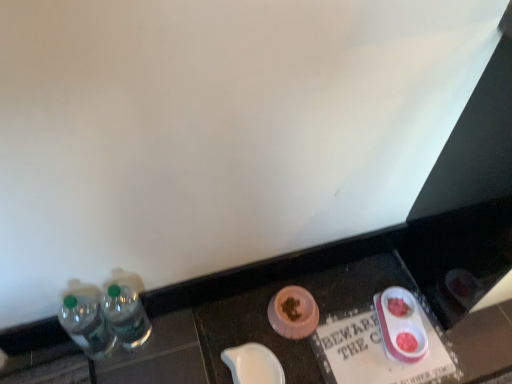
What do you see at coordinates (125, 308) in the screenshot? The image size is (512, 384). I see `clear plastic bottles at left, which is counted as the first bottle, starting from the right` at bounding box center [125, 308].

You are a GUI agent. You are given a task and a screenshot of the screen. Output one action in this format:
    pyautogui.click(x=<x>, y=<y>)
    Task: Click on the white paper sign at lower center
    The height and width of the screenshot is (384, 512).
    Given the screenshot: What is the action you would take?
    pyautogui.click(x=376, y=351)

Measure the distance between point (248, 273) and camera.

Point (248, 273) and camera are 4.66 feet apart.

Where is `clear plastic bottles at left`? Image resolution: width=512 pixels, height=384 pixels. clear plastic bottles at left is located at coordinates (316, 293).

The height and width of the screenshot is (384, 512). I want to click on clear plastic bottles at left, which is counted as the first bottle, starting from the right, so click(125, 308).

Could you tell me if clear plastic bottles at left is turned towards white paper sign at lower center?

Yes, clear plastic bottles at left is oriented towards white paper sign at lower center.

Is clear plastic bottles at left not within white paper sign at lower center?

Absolutely, clear plastic bottles at left is external to white paper sign at lower center.

Considering the sizes of objects clear plastic bottles at left and white paper sign at lower center in the image provided, who is wider, clear plastic bottles at left or white paper sign at lower center?

With larger width is white paper sign at lower center.

From the image's perspective, would you say clear plastic bottles at left is positioned over white paper sign at lower center?

Indeed, from the image's perspective, clear plastic bottles at left is shown above white paper sign at lower center.

Is clear plastic bottles at left smaller than clear plastic bottles at left, the 2th bottle viewed from the left?

No.

Is clear plastic bottles at left taller than clear plastic bottles at left, which is counted as the first bottle, starting from the right?

No.

Does clear plastic bottles at left have a lesser width compared to clear plastic bottles at left, which is counted as the first bottle, starting from the right?

Yes.

What's the angular difference between clear plastic bottles at left and clear plastic bottles at left, the 2th bottle viewed from the left,'s facing directions?

0.929 degrees.

How many degrees apart are the facing directions of white paper sign at lower center and pink plastic food bowls at lower right, arranged as the 1th tableware when viewed from the right?

white paper sign at lower center and pink plastic food bowls at lower right, arranged as the 1th tableware when viewed from the right, are facing 19.8 degrees away from each other.

Is the position of white paper sign at lower center more distant than that of pink plastic food bowls at lower right, arranged as the 1th tableware when viewed from the right?

No.

Does white paper sign at lower center have a lesser width compared to pink plastic food bowls at lower right, arranged as the 1th tableware when viewed from the right?

In fact, white paper sign at lower center might be wider than pink plastic food bowls at lower right, arranged as the 1th tableware when viewed from the right.

Is white paper sign at lower center taller than pink plastic food bowls at lower right, placed as the second tableware when sorted from left to right?

Incorrect, the height of white paper sign at lower center is not larger of that of pink plastic food bowls at lower right, placed as the second tableware when sorted from left to right.

Looking at this image, could you tell me if clear plastic bottles at left, positioned as the second bottle in right-to-left order, is turned towards pink plastic food bowls at lower right, placed as the second tableware when sorted from left to right?

No, clear plastic bottles at left, positioned as the second bottle in right-to-left order, is not facing towards pink plastic food bowls at lower right, placed as the second tableware when sorted from left to right.

Is clear plastic bottles at left, positioned as the second bottle in right-to-left order, not inside pink plastic food bowls at lower right, placed as the second tableware when sorted from left to right?

clear plastic bottles at left, positioned as the second bottle in right-to-left order, is positioned outside pink plastic food bowls at lower right, placed as the second tableware when sorted from left to right.

Which is behind, clear plastic bottles at left, positioned as the second bottle in right-to-left order, or pink plastic food bowls at lower right, placed as the second tableware when sorted from left to right?

pink plastic food bowls at lower right, placed as the second tableware when sorted from left to right, is behind.

Does clear plastic bottles at left, the 1th bottle viewed from the left, have a larger size compared to pink plastic food bowls at lower right, arranged as the 1th tableware when viewed from the right?

Indeed, clear plastic bottles at left, the 1th bottle viewed from the left, has a larger size compared to pink plastic food bowls at lower right, arranged as the 1th tableware when viewed from the right.

This screenshot has width=512, height=384. I want to click on tableware above the clear plastic bottles at left (from a real-world perspective), so click(401, 325).

Does clear plastic bottles at left have a greater width compared to pink plastic food bowls at lower right, arranged as the 1th tableware when viewed from the right?

Incorrect, the width of clear plastic bottles at left does not surpass that of pink plastic food bowls at lower right, arranged as the 1th tableware when viewed from the right.

Is clear plastic bottles at left positioned behind pink plastic food bowls at lower right, arranged as the 1th tableware when viewed from the right?

No, the depth of clear plastic bottles at left is less than that of pink plastic food bowls at lower right, arranged as the 1th tableware when viewed from the right.

Which object is positioned more to the right, clear plastic bottles at left or pink plastic food bowls at lower right, arranged as the 1th tableware when viewed from the right?

pink plastic food bowls at lower right, arranged as the 1th tableware when viewed from the right, is more to the right.

Considering the relative sizes of white glossy bowl at lower center, the 2th tableware positioned from the right, and pink plastic food bowls at lower right, placed as the second tableware when sorted from left to right, in the image provided, is white glossy bowl at lower center, the 2th tableware positioned from the right, taller than pink plastic food bowls at lower right, placed as the second tableware when sorted from left to right,?

No.

Is white glossy bowl at lower center, the 2th tableware positioned from the right, to the left of pink plastic food bowls at lower right, arranged as the 1th tableware when viewed from the right, from the viewer's perspective?

Yes.

Is white glossy bowl at lower center, the 2th tableware positioned from the right, positioned with its back to pink plastic food bowls at lower right, placed as the second tableware when sorted from left to right?

No.

Would you consider white glossy bowl at lower center, the 2th tableware positioned from the right, to be distant from pink plastic food bowls at lower right, arranged as the 1th tableware when viewed from the right?

They are positioned close to each other.

Is clear plastic bottles at left, the 2th bottle viewed from the left, shorter than clear plastic bottles at left?

In fact, clear plastic bottles at left, the 2th bottle viewed from the left, may be taller than clear plastic bottles at left.

Is clear plastic bottles at left, the 2th bottle viewed from the left, aimed at clear plastic bottles at left?

No.

Where is `writing on the right of the clear plastic bottles at left`? The height and width of the screenshot is (384, 512). writing on the right of the clear plastic bottles at left is located at coordinates (376, 351).

You are a GUI agent. You are given a task and a screenshot of the screen. Output one action in this format:
    pyautogui.click(x=<x>, y=<y>)
    Task: Click on the 1st bottle counting from the left side of the clear plastic bottles at left
    
    Given the screenshot: What is the action you would take?
    pyautogui.click(x=125, y=308)

Based on their spatial positions, is clear plastic bottles at left or white paper sign at lower center closer to clear plastic bottles at left, which is counted as the first bottle, starting from the right?

clear plastic bottles at left is positioned closer to the anchor clear plastic bottles at left, which is counted as the first bottle, starting from the right.

Looking at the image, which one is located closer to white glossy bowl at lower center, the first tableware in the left-to-right sequence, clear plastic bottles at left, the 1th bottle viewed from the left, or pink plastic food bowls at lower right, placed as the second tableware when sorted from left to right?

pink plastic food bowls at lower right, placed as the second tableware when sorted from left to right, is closer to white glossy bowl at lower center, the first tableware in the left-to-right sequence.

Based on the photo, when comparing their distances from white glossy bowl at lower center, the 2th tableware positioned from the right, does pink plastic food bowls at lower right, placed as the second tableware when sorted from left to right, or clear plastic bottles at left seem further?

The object further to white glossy bowl at lower center, the 2th tableware positioned from the right, is pink plastic food bowls at lower right, placed as the second tableware when sorted from left to right.

Looking at the image, which one is located closer to pink plastic food bowls at lower right, arranged as the 1th tableware when viewed from the right, clear plastic bottles at left, which is counted as the first bottle, starting from the right, or clear plastic bottles at left, positioned as the second bottle in right-to-left order?

The object closer to pink plastic food bowls at lower right, arranged as the 1th tableware when viewed from the right, is clear plastic bottles at left, which is counted as the first bottle, starting from the right.

Considering their positions, is white paper sign at lower center positioned further to clear plastic bottles at left, positioned as the second bottle in right-to-left order, than clear plastic bottles at left, the 2th bottle viewed from the left?

white paper sign at lower center is positioned further to the anchor clear plastic bottles at left, positioned as the second bottle in right-to-left order.

Considering their positions, is white glossy bowl at lower center, the first tableware in the left-to-right sequence, positioned closer to pink plastic food bowls at lower right, placed as the second tableware when sorted from left to right, than clear plastic bottles at left, positioned as the second bottle in right-to-left order?

white glossy bowl at lower center, the first tableware in the left-to-right sequence, is positioned closer to the anchor pink plastic food bowls at lower right, placed as the second tableware when sorted from left to right.

Looking at the image, which one is located further to white paper sign at lower center, clear plastic bottles at left or clear plastic bottles at left, which is counted as the first bottle, starting from the right?

Among the two, clear plastic bottles at left, which is counted as the first bottle, starting from the right, is located further to white paper sign at lower center.

From the image, which object appears to be farther from clear plastic bottles at left, white paper sign at lower center or clear plastic bottles at left, which is counted as the first bottle, starting from the right?

Among the two, clear plastic bottles at left, which is counted as the first bottle, starting from the right, is located further to clear plastic bottles at left.

The image size is (512, 384). Find the location of `writing situated between clear plastic bottles at left, the 2th bottle viewed from the left, and pink plastic food bowls at lower right, placed as the second tableware when sorted from left to right, from left to right`. writing situated between clear plastic bottles at left, the 2th bottle viewed from the left, and pink plastic food bowls at lower right, placed as the second tableware when sorted from left to right, from left to right is located at coordinates (376, 351).

The image size is (512, 384). Identify the location of tableware situated between clear plastic bottles at left and pink plastic food bowls at lower right, placed as the second tableware when sorted from left to right, from left to right. (253, 364).

The height and width of the screenshot is (384, 512). In order to click on bottle between clear plastic bottles at left, positioned as the second bottle in right-to-left order, and clear plastic bottles at left from left to right in this screenshot , I will do `click(125, 308)`.

At what (x,y) coordinates should I click in order to perform the action: click on bottle located between clear plastic bottles at left, the 1th bottle viewed from the left, and pink plastic food bowls at lower right, arranged as the 1th tableware when viewed from the right, in the left-right direction. Please return your answer as a coordinate pair (x, y). Looking at the image, I should click on (125, 308).